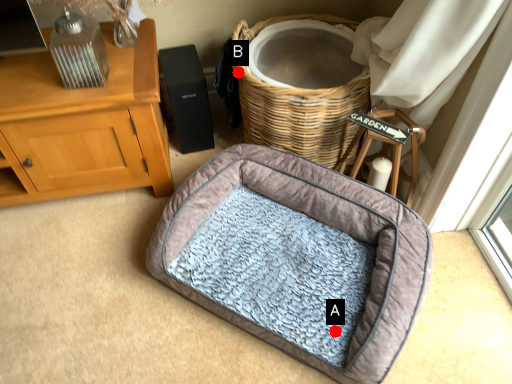
Question: Two points are circled on the image, labeled by A and B beside each circle. Which point is closer to the camera?

Choices:
 (A) A is closer
 (B) B is closer

Answer: (A)